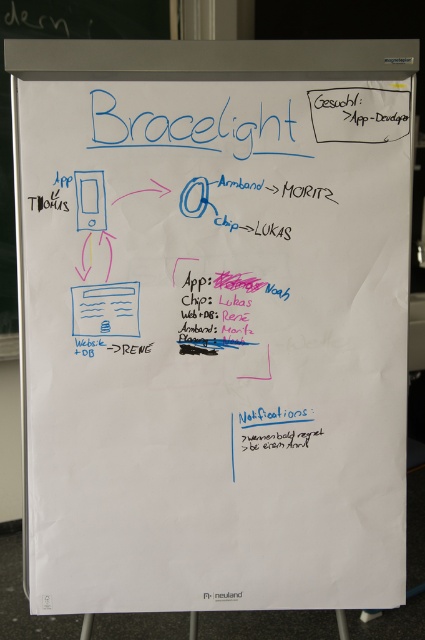
Question: Which object is farther from the camera taking this photo?

Choices:
 (A) white paperboard at upper left
 (B) matte white web page at center

Answer: (A)

Question: Among these points, which one is nearest to the camera?

Choices:
 (A) (10, 234)
 (B) (76, 300)

Answer: (B)

Question: Does white paperboard at upper left lie behind matte white web page at center?

Choices:
 (A) no
 (B) yes

Answer: (B)

Question: From the image, what is the correct spatial relationship of white paperboard at upper left in relation to matte white web page at center?

Choices:
 (A) below
 (B) above

Answer: (B)

Question: Is white paperboard at upper left positioned in front of matte white web page at center?

Choices:
 (A) no
 (B) yes

Answer: (A)

Question: Among these objects, which one is farthest from the camera?

Choices:
 (A) matte white web page at center
 (B) white paperboard at upper left

Answer: (B)